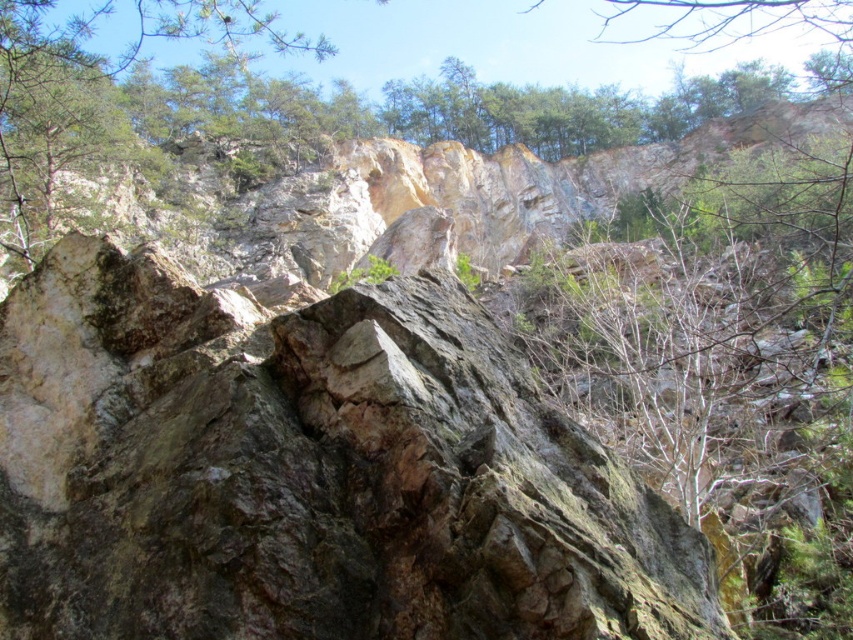
Between rocky cliff at center and green leafy tree at upper center, which one has more height?

green leafy tree at upper center

Looking at this image, is rocky cliff at center further to the viewer compared to green leafy tree at upper center?

No, rocky cliff at center is in front of green leafy tree at upper center.

Find the location of `rocky cliff at center`. rocky cliff at center is located at coordinates (308, 472).

Which is more to the right, rocky cliff at center or green rough rock at upper left?

rocky cliff at center

Does rocky cliff at center have a greater width compared to green rough rock at upper left?

No.

This screenshot has width=853, height=640. Describe the element at coordinates (308, 472) in the screenshot. I see `rocky cliff at center` at that location.

Find the location of a particular element. rocky cliff at center is located at coordinates (308, 472).

Who is lower down, green leafy tree at upper center or green rough rock at upper left?

green rough rock at upper left is below.

Is point (132, 198) more distant than point (7, 182)?

Yes, it is behind point (7, 182).

Does point (602, 124) come closer to viewer compared to point (64, 154)?

No, it is behind (64, 154).

Locate an element on the screen. green leafy tree at upper center is located at coordinates (315, 144).